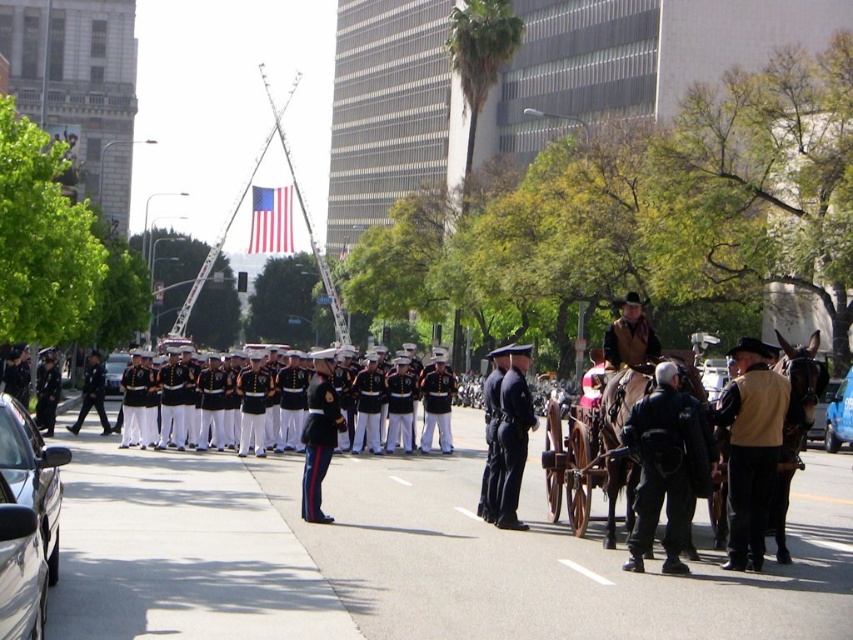
In the scene shown: Based on the scene description, can you determine the spatial relationship between the dark blue uniform at center and the silver metallic sedan at center? Specifically, which object is positioned to the right of the other?

The dark blue uniform at center is to the right of the silver metallic sedan at center.

You are a photographer at the event and need to park your compact camera bag between the metallic blue car at center and the silver metallic sedan at center. Given that your bag is 0.5 meters wide, can you fit it between them without moving either vehicle?

The metallic blue car at center is thinner than the silver metallic sedan at center, so there is enough space between them to fit your 0.5 meters wide camera bag.

You are a photographer at the event and want to capture a photo that includes both the metallic blue car at center and the silver metallic sedan at center. Based on their positions, which car should be positioned closer to the front of the photo to ensure both are fully visible?

The metallic blue car at center should be positioned closer to the front of the photo because the silver metallic sedan at center is behind it, so placing the metallic blue car forward will allow both to be visible without obstruction.